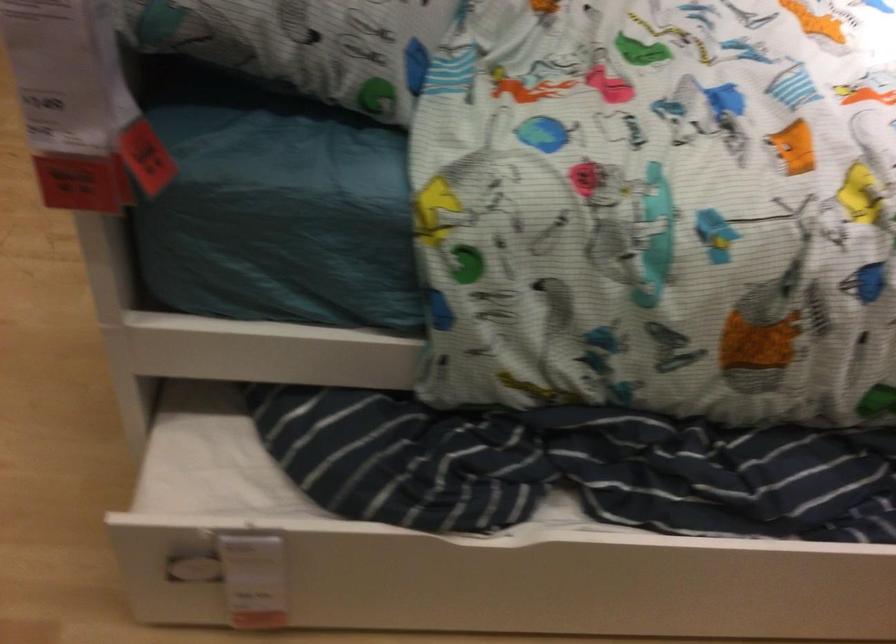
Where is `white recessed handle`? Image resolution: width=896 pixels, height=644 pixels. white recessed handle is located at coordinates (240, 574).